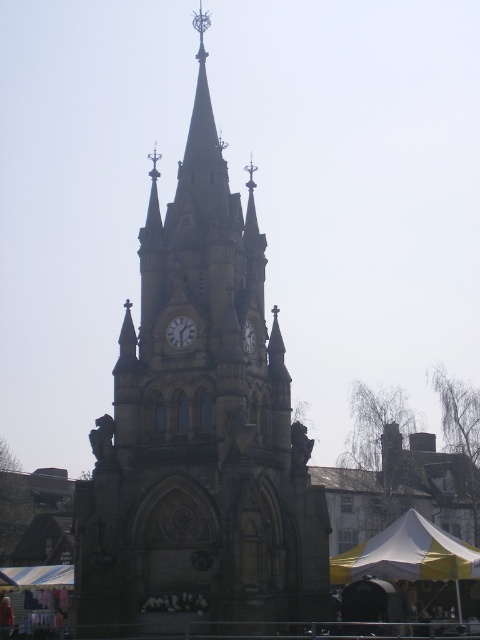
Question: Can you confirm if yellow fabric tent at lower right is positioned to the right of matte stone clock at center?

Choices:
 (A) no
 (B) yes

Answer: (B)

Question: Which point is closer to the camera taking this photo?

Choices:
 (A) pyautogui.click(x=50, y=573)
 (B) pyautogui.click(x=274, y=390)

Answer: (B)

Question: Does stone clock tower at center appear on the left side of yellow fabric tent at lower right?

Choices:
 (A) yes
 (B) no

Answer: (A)

Question: Which is nearer to the stone clock tower at center?

Choices:
 (A) matte stone clock at center
 (B) yellow fabric tent at lower right
 (C) matte gray clock at center

Answer: (C)

Question: Which of these objects is positioned closest to the matte gray clock at center?

Choices:
 (A) white fabric canopy at lower left
 (B) stone clock tower at center
 (C) yellow fabric tent at lower right

Answer: (B)

Question: Can you confirm if white fabric canopy at lower left is bigger than matte stone clock at center?

Choices:
 (A) no
 (B) yes

Answer: (B)